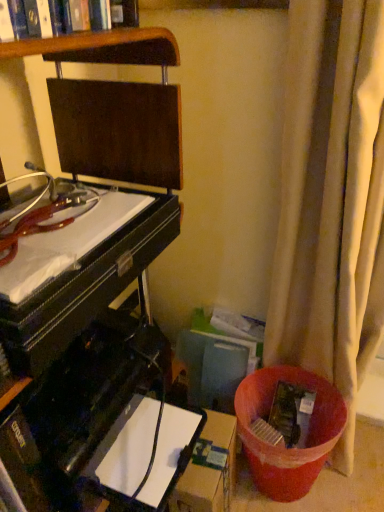
What do you see at coordinates (209, 469) in the screenshot? This screenshot has height=512, width=384. I see `brown cardboard box at lower center` at bounding box center [209, 469].

Identify the location of beige fabric curtain at right. This screenshot has height=512, width=384. (331, 201).

Does brown cardboard box at lower center have a greater width compared to black glossy computer desk at left?

In fact, brown cardboard box at lower center might be narrower than black glossy computer desk at left.

Which object is positioned more to the right, brown cardboard box at lower center or black glossy computer desk at left?

brown cardboard box at lower center.

Find the location of a particular element. computer desk above the brown cardboard box at lower center (from the image's perspective) is located at coordinates [77, 341].

Is brown cardboard box at lower center completely or partially outside of black glossy computer desk at left?

brown cardboard box at lower center is positioned outside black glossy computer desk at left.

Looking at this image, is brown cardboard box at lower center outside of beige fabric curtain at right?

brown cardboard box at lower center is positioned outside beige fabric curtain at right.

Is brown cardboard box at lower center closer to camera compared to beige fabric curtain at right?

No, it is not.

Does brown cardboard box at lower center have a lesser height compared to beige fabric curtain at right?

Yes, brown cardboard box at lower center is shorter than beige fabric curtain at right.

Is beige fabric curtain at right to the right of black glossy computer desk at left from the viewer's perspective?

Correct, you'll find beige fabric curtain at right to the right of black glossy computer desk at left.

Is beige fabric curtain at right smaller than black glossy computer desk at left?

Indeed, beige fabric curtain at right has a smaller size compared to black glossy computer desk at left.

From a real-world perspective, between beige fabric curtain at right and black glossy computer desk at left, who is vertically higher?

In real-world perspective, black glossy computer desk at left is above.

Is beige fabric curtain at right oriented towards black glossy computer desk at left?

No, beige fabric curtain at right is not facing towards black glossy computer desk at left.

Measure the distance from black glossy computer desk at left to beige fabric curtain at right.

19.41 inches.

I want to click on computer desk located below the beige fabric curtain at right (from the image's perspective), so click(x=77, y=341).

From a real-world perspective, who is located lower, black glossy computer desk at left or beige fabric curtain at right?

From a 3D spatial view, beige fabric curtain at right is below.

Choose the correct answer: Is black glossy computer desk at left inside beige fabric curtain at right or outside it?

black glossy computer desk at left cannot be found inside beige fabric curtain at right.

From the image's perspective, who appears lower, black glossy computer desk at left or brown cardboard box at lower center?

brown cardboard box at lower center, from the image's perspective.

From a real-world perspective, who is located higher, black glossy computer desk at left or brown cardboard box at lower center?

In real-world perspective, black glossy computer desk at left is above.

Which object is further away from the camera taking this photo, black glossy computer desk at left or brown cardboard box at lower center?

brown cardboard box at lower center is further away from the camera.

Is black glossy computer desk at left turned away from brown cardboard box at lower center?

No, brown cardboard box at lower center is not at the back of black glossy computer desk at left.

Which of these two, beige fabric curtain at right or brown cardboard box at lower center, is smaller?

Smaller between the two is brown cardboard box at lower center.

Does beige fabric curtain at right have a lesser width compared to brown cardboard box at lower center?

In fact, beige fabric curtain at right might be wider than brown cardboard box at lower center.

Is beige fabric curtain at right looking in the opposite direction of brown cardboard box at lower center?

beige fabric curtain at right does not have its back to brown cardboard box at lower center.

Which of these two, beige fabric curtain at right or brown cardboard box at lower center, stands shorter?

Standing shorter between the two is brown cardboard box at lower center.

In order to click on cardboard box that is below the black glossy computer desk at left (from the image's perspective) in this screenshot , I will do `click(209, 469)`.

You are a GUI agent. You are given a task and a screenshot of the screen. Output one action in this format:
    pyautogui.click(x=<x>, y=<y>)
    Task: Click on the curtain that appears above the brown cardboard box at lower center (from a real-world perspective)
    The width and height of the screenshot is (384, 512).
    Given the screenshot: What is the action you would take?
    [331, 201]

Looking at the image, which one is located closer to beige fabric curtain at right, brown cardboard box at lower center or black glossy computer desk at left?

The object closer to beige fabric curtain at right is black glossy computer desk at left.

Considering their positions, is beige fabric curtain at right positioned further to brown cardboard box at lower center than black glossy computer desk at left?

beige fabric curtain at right is positioned further to the anchor brown cardboard box at lower center.

Based on their spatial positions, is black glossy computer desk at left or beige fabric curtain at right further from brown cardboard box at lower center?

Among the two, beige fabric curtain at right is located further to brown cardboard box at lower center.

Which object lies nearer to the anchor point beige fabric curtain at right, black glossy computer desk at left or brown cardboard box at lower center?

black glossy computer desk at left is positioned closer to the anchor beige fabric curtain at right.

Estimate the real-world distances between objects in this image. Which object is further from black glossy computer desk at left, beige fabric curtain at right or brown cardboard box at lower center?

beige fabric curtain at right is positioned further to the anchor black glossy computer desk at left.

Which object lies further to the anchor point black glossy computer desk at left, brown cardboard box at lower center or beige fabric curtain at right?

beige fabric curtain at right lies further to black glossy computer desk at left than the other object.

At what (x,y) coordinates should I click in order to perform the action: click on computer desk between beige fabric curtain at right and brown cardboard box at lower center in the up-down direction. Please return your answer as a coordinate pair (x, y). The height and width of the screenshot is (512, 384). Looking at the image, I should click on (77, 341).